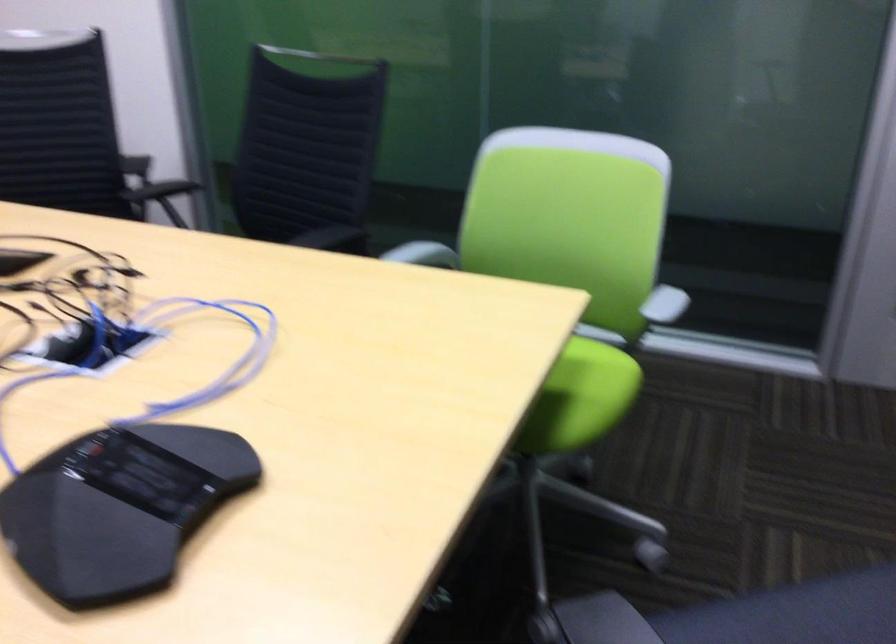
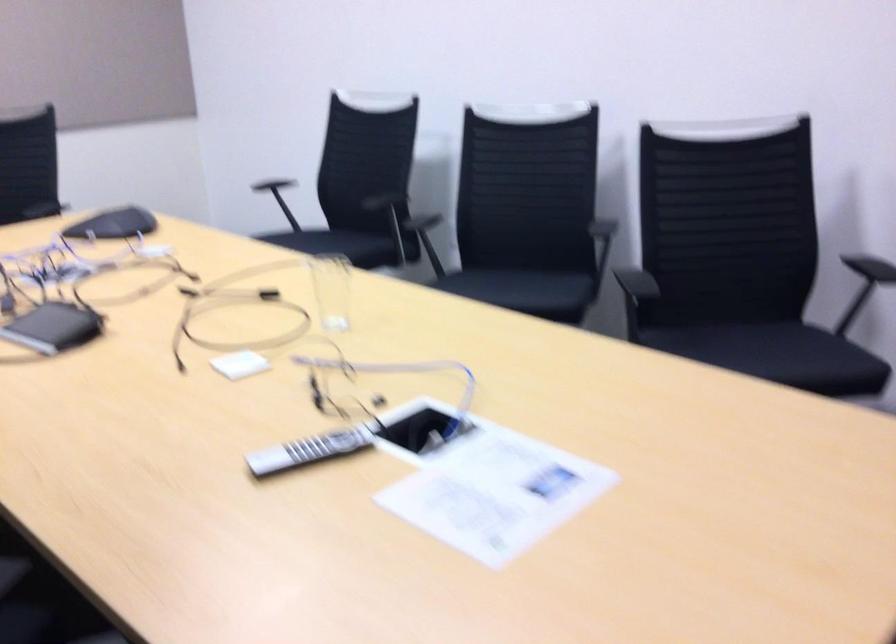
Question: I am providing you with two images of the same scene from different viewpoints. After the viewpoint changes to image2, which objects are now occluded?

Choices:
 (A) grey remote control
 (B) drinking glass
 (C) black tablet
 (D) black conference phone

Answer: (D)